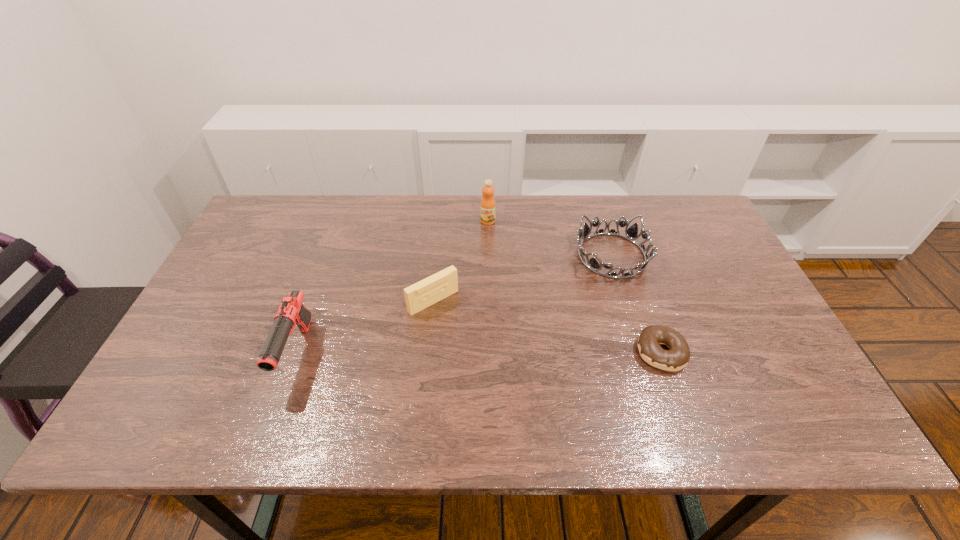
In order to click on the leftmost object in this screenshot , I will do `click(291, 312)`.

You are a GUI agent. You are given a task and a screenshot of the screen. Output one action in this format:
    pyautogui.click(x=<x>, y=<y>)
    Task: Click on the doughnut
    
    Given the screenshot: What is the action you would take?
    pyautogui.click(x=677, y=357)

Identify the location of the farthest object. (488, 205).

Find the location of a particular element. This screenshot has width=960, height=540. orange juice is located at coordinates (488, 205).

The height and width of the screenshot is (540, 960). Find the location of `the fourth nearest object`. the fourth nearest object is located at coordinates (631, 233).

The image size is (960, 540). I want to click on the second object from left to right, so click(x=442, y=284).

Find the location of a particular element. the third nearest object is located at coordinates (442, 284).

Identify the location of vacant position located on the left of the shortest object. Image resolution: width=960 pixels, height=540 pixels. (485, 352).

This screenshot has width=960, height=540. What are the coordinates of `free space located 0.290m on the front label of the orange juice` in the screenshot? It's located at (460, 288).

Locate an element on the screen. This screenshot has height=540, width=960. vacant space positioned on the front label of the orange juice is located at coordinates (477, 247).